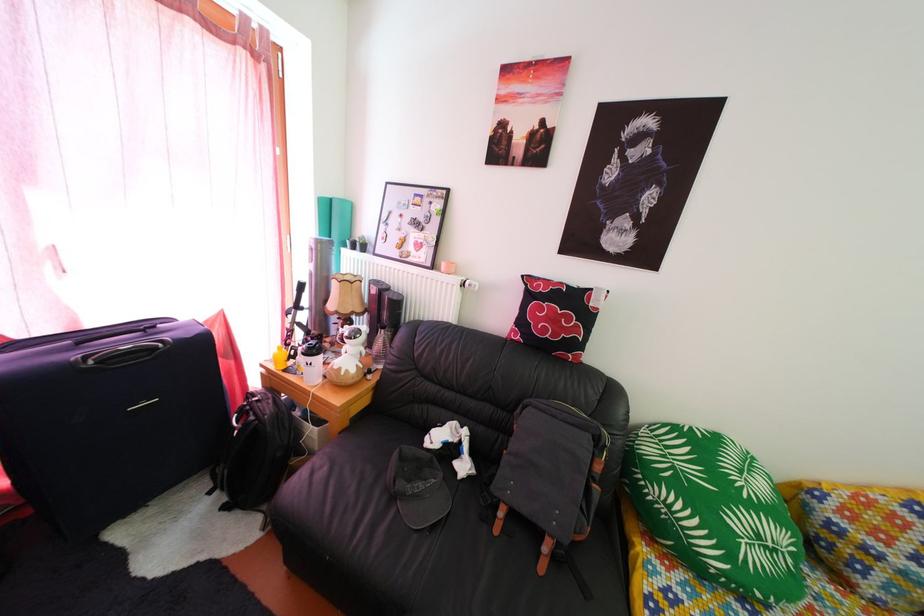
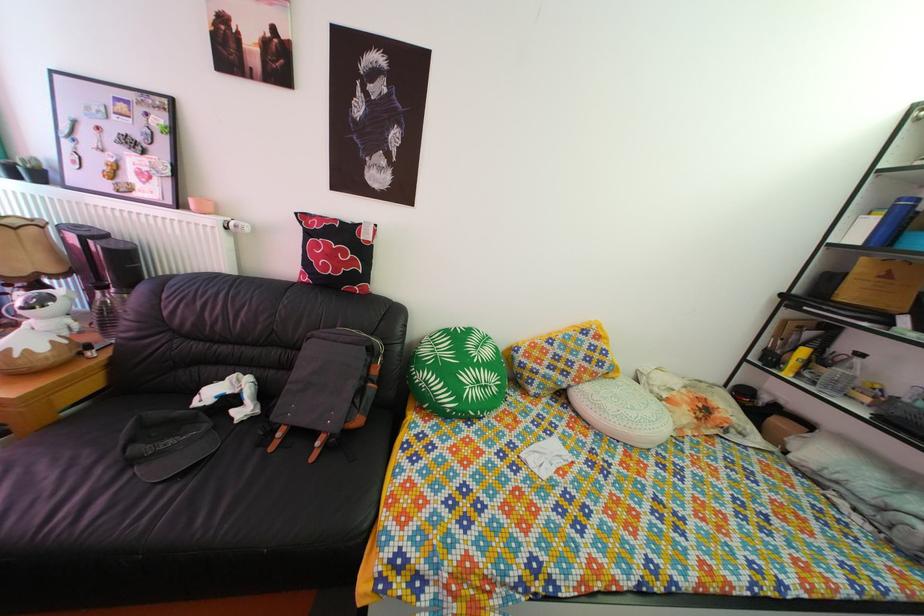
The point at (784,560) is marked in the first image. Where is the corresponding point in the second image?

(494, 395)